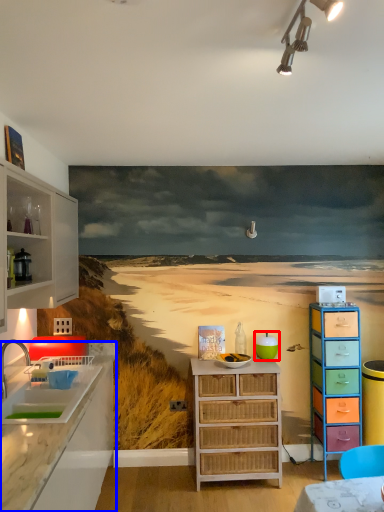
Question: Which point is closer to the camera, teal (highlighted by a red box) or countertop (highlighted by a blue box)?

Choices:
 (A) teal
 (B) countertop

Answer: (B)